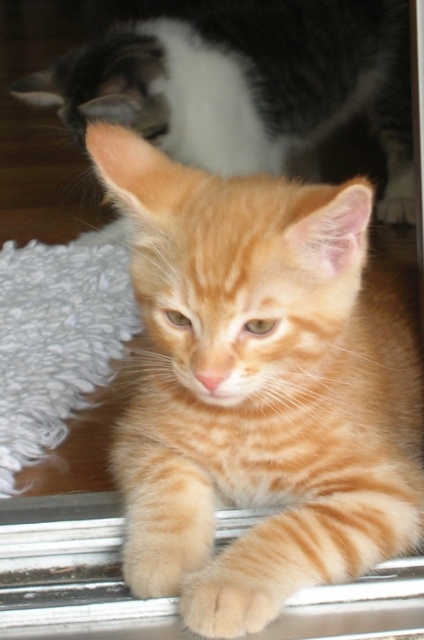
You are a cat owner who wants to ensure your kitten stays safe on the windowsill. The metallic silver window sill at lower center has a soft orange fur paw at lower center touching it. Which side of the window sill is the paw closer to?

The soft orange fur paw at lower center is closer to the right side of the metallic silver window sill at lower center since the window sill is to the left of the paw.

You are a cat owner who wants to place a small toy on the windowsill where the orange striped kitten at center is resting. The toy is 10 cm wide. Can the toy fit on the metallic silver window sill at lower center if the window sill is 30 cm wide?

The metallic silver window sill at lower center is 30 cm wide. Since the toy is 10 cm wide, it can fit comfortably on the window sill.

From the picture: You are a photographer trying to capture a close shot of the ginger kitten resting on the windowsill. There are two points of interest in the image marked as point 1 at coordinates point (x=78, y=132) and point 2 at coordinates point (x=17, y=589). Which point is closer to you, the photographer?

Point (x=78, y=132) is further to the viewer than point (x=17, y=589). Therefore, point (x=78, y=132) is closer to you, the photographer.